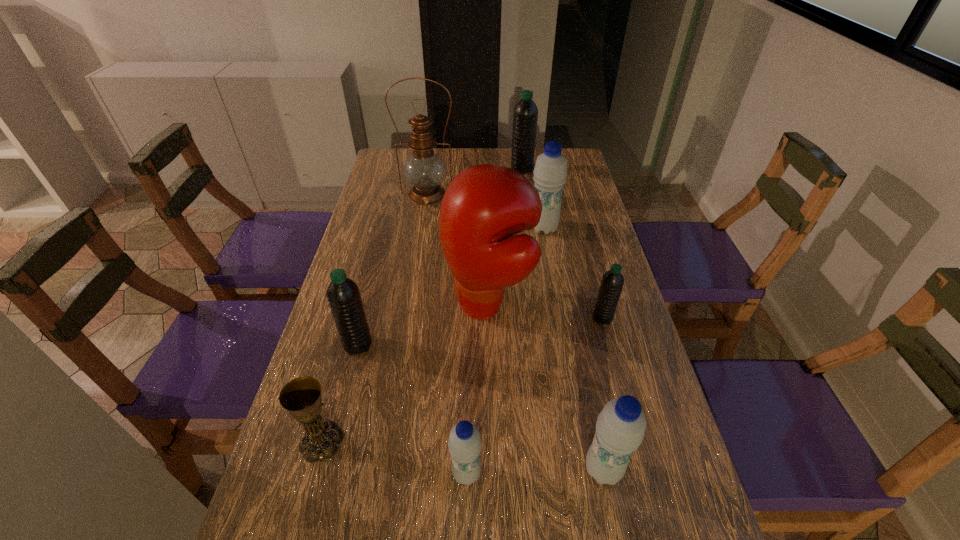
Find the location of a particular element. The image size is (960, 540). vacant space at the right edge of the desktop is located at coordinates (643, 521).

Where is `vacant point located between the rightmost water bottle and the gold chalice`? The image size is (960, 540). vacant point located between the rightmost water bottle and the gold chalice is located at coordinates (462, 380).

At what (x,y) coordinates should I click in order to perform the action: click on unoccupied area between the fifth nearest water bottle and the second biggest blue water bottle. Please return your answer as a coordinate pair (x, y). Looking at the image, I should click on (573, 349).

At what (x,y) coordinates should I click in order to perform the action: click on vacant area between the second smallest blue water bottle and the second nearest black water bottle. Please return your answer as a coordinate pair (x, y). Image resolution: width=960 pixels, height=540 pixels. Looking at the image, I should click on (603, 394).

The height and width of the screenshot is (540, 960). Identify the location of vacant space that is in between the second biggest blue water bottle and the leftmost water bottle. (481, 407).

Identify the location of empty space that is in between the farthest object and the fifth water bottle from right to left. The image size is (960, 540). (494, 321).

I want to click on free space between the second biggest blue water bottle and the boxing glove, so click(x=545, y=387).

Identify which object is located as the sixth nearest to the leftmost blue water bottle. Please provide its 2D coordinates. Your answer should be formatted as a tuple, i.e. [(x, y)], where the tuple contains the x and y coordinates of a point satisfying the conditions above.

[(550, 172)]

Locate an element on the screen. This screenshot has width=960, height=540. object identified as the fifth closest to the second biggest blue water bottle is located at coordinates (343, 295).

Find the location of a particular element. the fourth closest water bottle to the gold chalice is located at coordinates (612, 282).